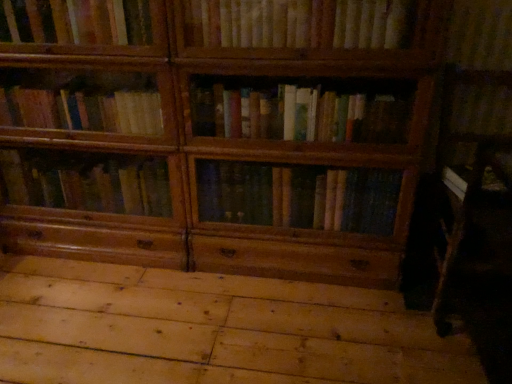
Question: Would you say natural wood floor at lower center is inside or outside wooden bookshelf at upper center?

Choices:
 (A) inside
 (B) outside

Answer: (B)

Question: Would you say natural wood floor at lower center is to the left or to the right of wooden bookshelf at upper center in the picture?

Choices:
 (A) right
 (B) left

Answer: (B)

Question: From their relative heights in the image, would you say natural wood floor at lower center is taller or shorter than wooden bookshelf at upper center?

Choices:
 (A) short
 (B) tall

Answer: (A)

Question: From a real-world perspective, is wooden bookshelf at upper center physically located above or below natural wood floor at lower center?

Choices:
 (A) above
 (B) below

Answer: (A)

Question: From their relative heights in the image, would you say wooden bookshelf at upper center is taller or shorter than natural wood floor at lower center?

Choices:
 (A) short
 (B) tall

Answer: (B)

Question: Is wooden bookshelf at upper center bigger or smaller than natural wood floor at lower center?

Choices:
 (A) small
 (B) big

Answer: (A)

Question: Is point (193, 19) closer or farther from the camera than point (199, 304)?

Choices:
 (A) farther
 (B) closer

Answer: (B)